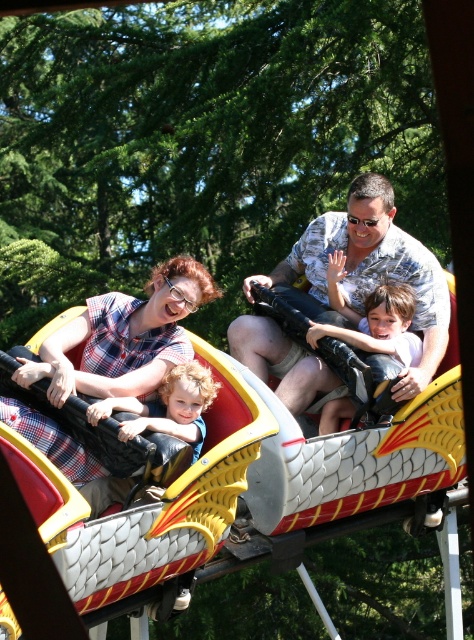
Between matte gray shirt at center and plaid fabric at center, which one appears on the left side from the viewer's perspective?

plaid fabric at center is more to the left.

Is matte gray shirt at center below plaid fabric at center?

Indeed, matte gray shirt at center is positioned under plaid fabric at center.

The height and width of the screenshot is (640, 474). In order to click on matte gray shirt at center in this screenshot , I will do `click(366, 275)`.

The height and width of the screenshot is (640, 474). I want to click on matte gray shirt at center, so click(x=366, y=275).

The width and height of the screenshot is (474, 640). What do you see at coordinates (125, 337) in the screenshot?
I see `plaid fabric at center` at bounding box center [125, 337].

At what (x,y) coordinates should I click in order to perform the action: click on plaid fabric at center. Please return your answer as a coordinate pair (x, y). Looking at the image, I should click on coord(125,337).

Who is positioned more to the left, matte gray shirt at center or smooth plastic toy at center?

matte gray shirt at center

Between point (353, 291) and point (415, 300), which one is positioned behind?

Positioned behind is point (353, 291).

Image resolution: width=474 pixels, height=640 pixels. Describe the element at coordinates (366, 275) in the screenshot. I see `matte gray shirt at center` at that location.

This screenshot has width=474, height=640. Identify the location of matte gray shirt at center. (366, 275).